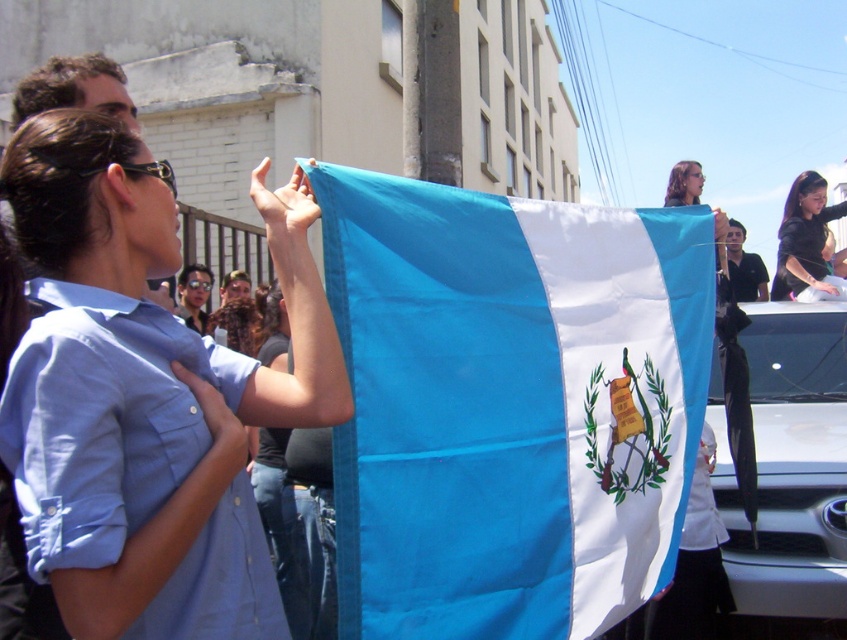
You are a photographer at the event and want to capture a photo where the blue fabric flag at upper center and the black glossy hair at upper right are both visible. Based on their sizes, which object should appear larger in the photo?

The blue fabric flag at upper center is taller than the black glossy hair at upper right, so it should appear larger in the photo.

You are a photographer at the event and want to capture the blue fabric flag at upper center. You notice a point marked at coordinates point (144, 394). Is this point on the flag?

Yes, the blue fabric flag at upper center is represented by point (144, 394), so the point is on the flag.